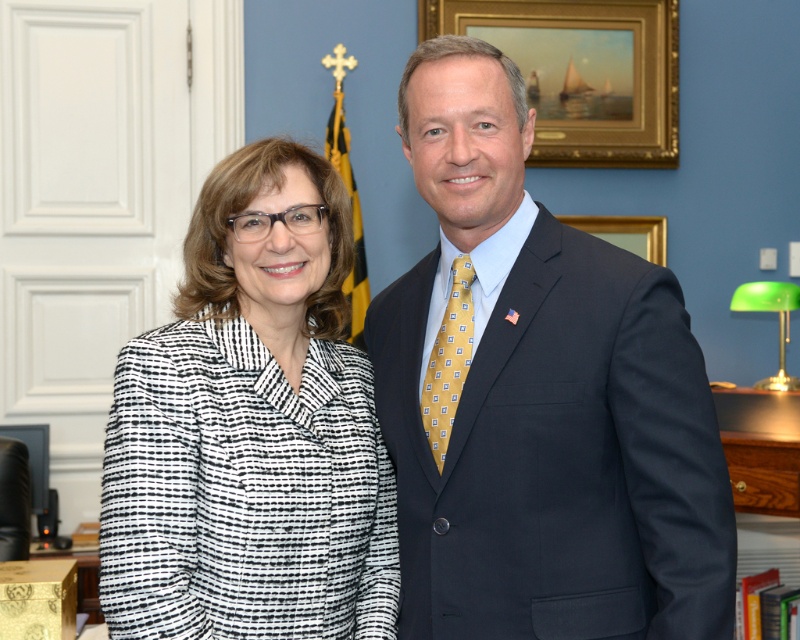
Question: Which object appears closest to the camera in this image?

Choices:
 (A) black textured blazer at center
 (B) gold/gilded picture frame at upper center

Answer: (A)

Question: Is wooden bookshelf at lower right closer to camera compared to gold silk tie at center?

Choices:
 (A) yes
 (B) no

Answer: (B)

Question: Where is matte black suit at center located in relation to wooden bookshelf at lower right in the image?

Choices:
 (A) below
 (B) above

Answer: (B)

Question: Which point appears farthest from the camera in this image?

Choices:
 (A) (468, 266)
 (B) (245, 480)

Answer: (A)

Question: Which of the following is the farthest from the observer?

Choices:
 (A) (358, 422)
 (B) (770, 493)

Answer: (B)

Question: In this image, where is wooden bookshelf at lower right located relative to gold silk tie at center?

Choices:
 (A) below
 (B) above

Answer: (A)